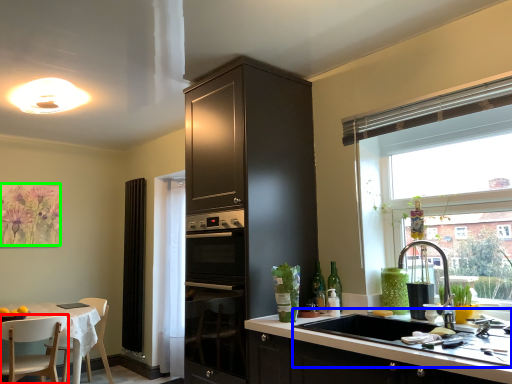
Question: Estimate the real-world distances between objects in this image. Which object is closer to chair (highlighted by a red box), sink (highlighted by a blue box) or flower (highlighted by a green box)?

Choices:
 (A) sink
 (B) flower

Answer: (B)